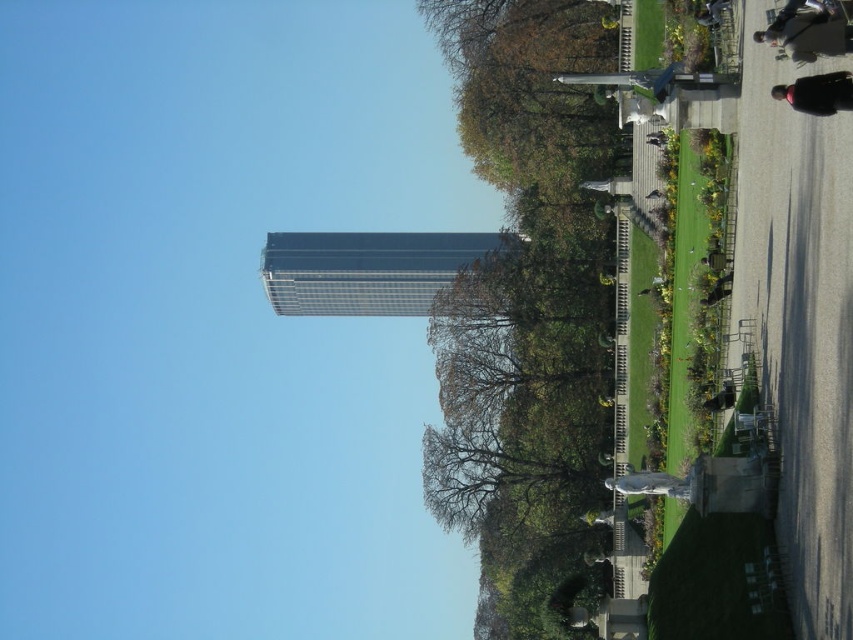
Question: Which of the following is the closest to the observer?

Choices:
 (A) dark gray jacket at upper right
 (B) green leafy tree at upper center

Answer: (A)

Question: Observing the image, what is the correct spatial positioning of green leafy tree at upper center in reference to dark gray jacket at upper right?

Choices:
 (A) left
 (B) right

Answer: (A)

Question: Which object is farther from the camera taking this photo?

Choices:
 (A) green leafy tree at upper center
 (B) black matte jacket at lower right
 (C) dark gray jacket at upper right

Answer: (A)

Question: Which of the following is the farthest from the observer?

Choices:
 (A) (483, 403)
 (B) (831, 88)

Answer: (A)

Question: Is green leafy tree at upper center below dark gray jacket at upper right?

Choices:
 (A) no
 (B) yes

Answer: (B)

Question: Is green leafy tree at upper center bigger than dark gray jacket at upper right?

Choices:
 (A) yes
 (B) no

Answer: (A)